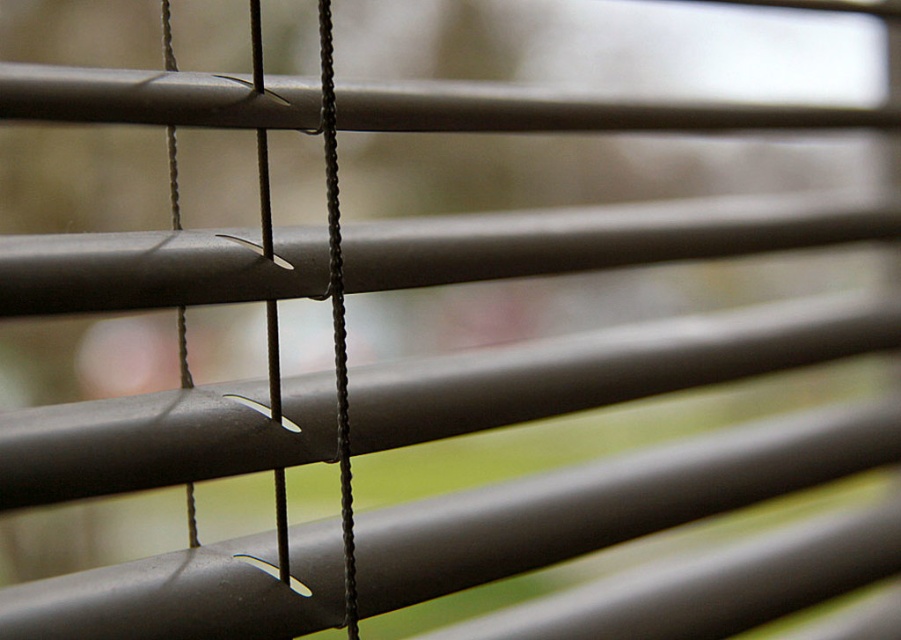
Question: Considering the relative positions of black cord at center and black matte string at left in the image provided, where is black cord at center located with respect to black matte string at left?

Choices:
 (A) right
 (B) left

Answer: (A)

Question: Estimate the real-world distances between objects in this image. Which object is closer to the black matte string at center?

Choices:
 (A) black cord at center
 (B) black matte string at left

Answer: (A)

Question: Considering the relative positions of black cord at center and black matte string at left in the image provided, where is black cord at center located with respect to black matte string at left?

Choices:
 (A) left
 (B) right

Answer: (B)

Question: Which point is closer to the camera taking this photo?

Choices:
 (A) 284,544
 (B) 181,344
 (C) 334,173

Answer: (A)

Question: Which is nearer to the black matte string at left?

Choices:
 (A) black cord at center
 (B) black matte string at center

Answer: (B)

Question: Does black matte string at center appear on the right side of black matte string at left?

Choices:
 (A) no
 (B) yes

Answer: (B)